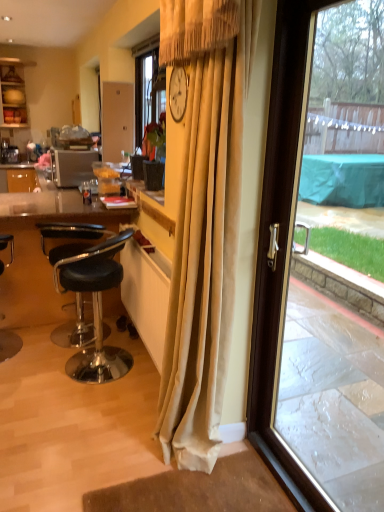
Question: Looking at the image, does matte brown plate at upper left seem bigger or smaller compared to beige velvet curtain at center?

Choices:
 (A) small
 (B) big

Answer: (A)

Question: From the image's perspective, is matte brown plate at upper left above or below beige velvet curtain at center?

Choices:
 (A) below
 (B) above

Answer: (B)

Question: Based on their relative distances, which object is nearer to the black leather stool at left, the 2th chair when ordered from left to right?

Choices:
 (A) matte wood cabinet at upper left
 (B) satin silver microwave at left
 (C) transparent glass door at right
 (D) beige velvet curtain at center
 (E) matte brown plate at upper left

Answer: (D)

Question: Which object is positioned farthest from the black leather stool at left, the 2th chair when ordered from left to right?

Choices:
 (A) matte black flowerpot at center
 (B) satin silver microwave at left
 (C) transparent glass door at right
 (D) matte wood cabinet at upper left
 (E) black leather stool at lower left, which is the 2th chair from right to left

Answer: (D)